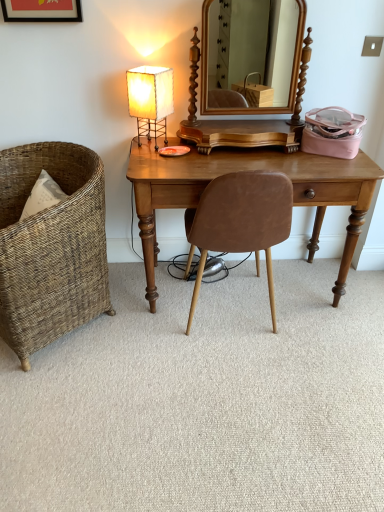
Question: Is woven wicker chair at left, arranged as the first chair when viewed from the left, positioned behind white paper lampshade at upper left?

Choices:
 (A) no
 (B) yes

Answer: (A)

Question: Does woven wicker chair at left, arranged as the second chair when viewed from the right, have a lesser width compared to white paper lampshade at upper left?

Choices:
 (A) no
 (B) yes

Answer: (A)

Question: Is woven wicker chair at left, arranged as the first chair when viewed from the left, at the right side of white paper lampshade at upper left?

Choices:
 (A) yes
 (B) no

Answer: (B)

Question: Is woven wicker chair at left, arranged as the second chair when viewed from the right, aimed at white paper lampshade at upper left?

Choices:
 (A) no
 (B) yes

Answer: (A)

Question: Can you confirm if woven wicker chair at left, arranged as the first chair when viewed from the left, is wider than white paper lampshade at upper left?

Choices:
 (A) no
 (B) yes

Answer: (B)

Question: In terms of height, does matte black picture frame at upper left look taller or shorter compared to light brown wood desk at center?

Choices:
 (A) tall
 (B) short

Answer: (B)

Question: Considering the positions of point (34, 3) and point (192, 173), is point (34, 3) closer or farther from the camera than point (192, 173)?

Choices:
 (A) closer
 (B) farther

Answer: (B)

Question: Based on their positions, is matte black picture frame at upper left located to the left or right of light brown wood desk at center?

Choices:
 (A) right
 (B) left

Answer: (B)

Question: Is matte black picture frame at upper left spatially inside light brown wood desk at center, or outside of it?

Choices:
 (A) outside
 (B) inside

Answer: (A)

Question: From the image's perspective, is brown leather chair at center, which is the 1th chair from right to left, located above or below white paper lampshade at upper left?

Choices:
 (A) below
 (B) above

Answer: (A)

Question: Is point (201, 252) closer or farther from the camera than point (145, 114)?

Choices:
 (A) farther
 (B) closer

Answer: (B)

Question: From a real-world perspective, is brown leather chair at center, which is the 1th chair from right to left, physically located above or below white paper lampshade at upper left?

Choices:
 (A) above
 (B) below

Answer: (B)

Question: Looking at the image, does brown leather chair at center, placed as the second chair when sorted from left to right, seem bigger or smaller compared to white paper lampshade at upper left?

Choices:
 (A) big
 (B) small

Answer: (A)

Question: Is point (150, 106) positioned closer to the camera than point (271, 71)?

Choices:
 (A) farther
 (B) closer

Answer: (B)

Question: From a real-world perspective, is white paper lampshade at upper left above or below wooden mirror at center?

Choices:
 (A) below
 (B) above

Answer: (A)